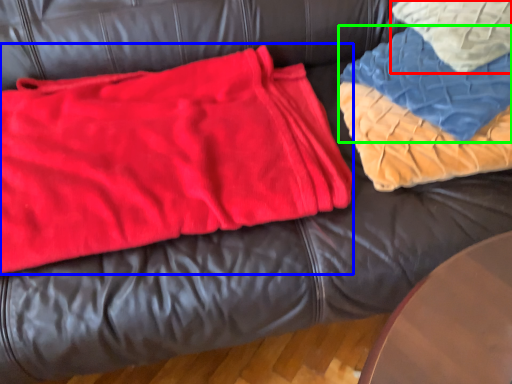
Question: Considering the real-world distances, which object is closest to throw pillow (highlighted by a red box)? bean bag chair (highlighted by a blue box) or blanket (highlighted by a green box).

Choices:
 (A) bean bag chair
 (B) blanket

Answer: (B)